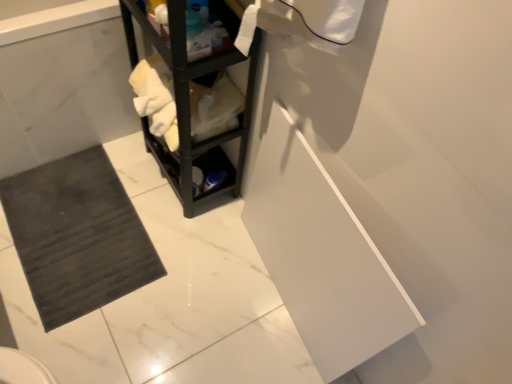
At what (x,y) coordinates should I click in order to perform the action: click on vacant space that is in between dark gray rubber bath mat at lower left and dark gray rubber bath mat at lower left. Please return your answer as a coordinate pair (x, y). Looking at the image, I should click on (144, 188).